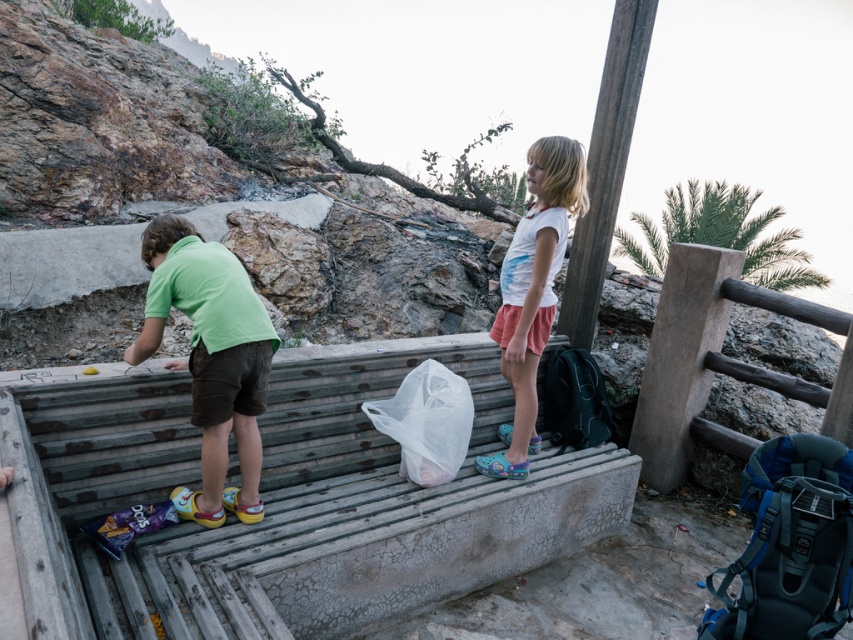
Which is below, blue fabric backpack at lower right or black fabric backpack at lower right?

blue fabric backpack at lower right is below.

Does blue fabric backpack at lower right appear under black fabric backpack at lower right?

Yes, blue fabric backpack at lower right is below black fabric backpack at lower right.

I want to click on blue fabric backpack at lower right, so click(790, 545).

Which is behind, point (425, 448) or point (579, 349)?

The point (579, 349) is more distant.

Can you confirm if transparent plastic bag at center is positioned above black fabric backpack at lower right?

No, transparent plastic bag at center is not above black fabric backpack at lower right.

Based on the photo, measure the distance between point (381, 403) and camera.

Point (381, 403) is 9.69 feet from camera.

Locate an element on the screen. transparent plastic bag at center is located at coordinates (426, 422).

Measure the distance between white cotton shirt at center and black fabric backpack at lower right.

They are 52.36 centimeters apart.

Is white cotton shirt at center thinner than black fabric backpack at lower right?

No.

You are a GUI agent. You are given a task and a screenshot of the screen. Output one action in this format:
    pyautogui.click(x=<x>, y=<y>)
    Task: Click on the white cotton shirt at center
    Image resolution: width=853 pixels, height=640 pixels.
    Given the screenshot: What is the action you would take?
    pyautogui.click(x=532, y=291)